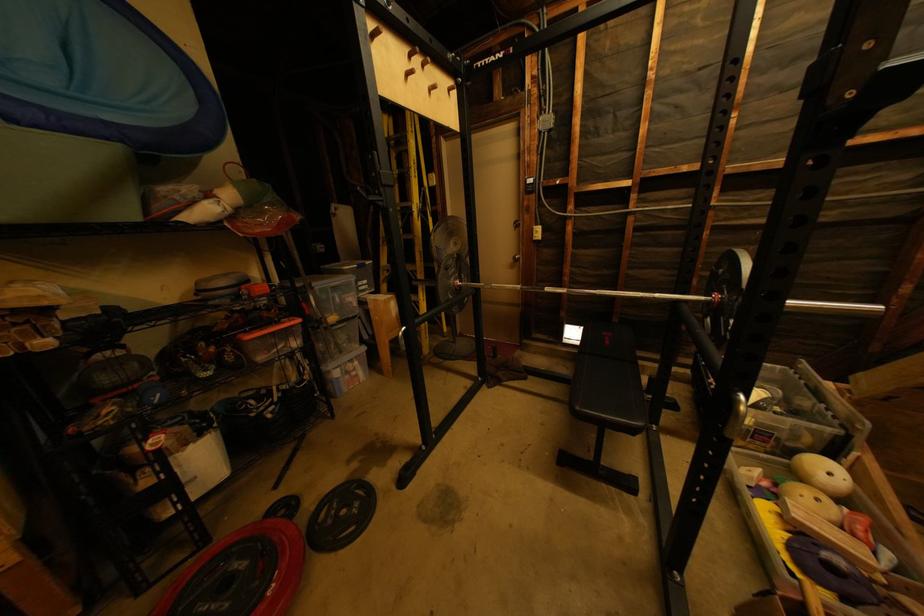
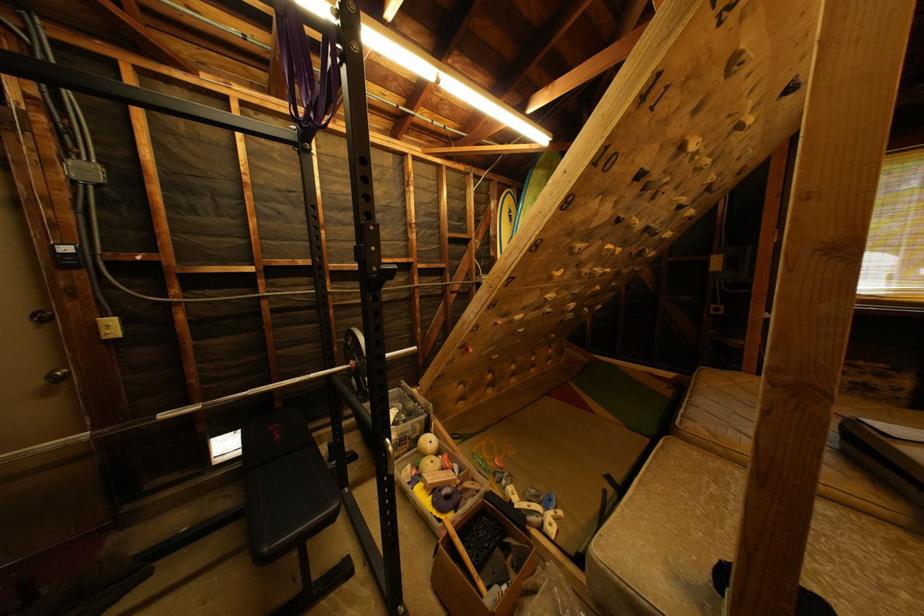
Question: How did the camera likely rotate?

Choices:
 (A) Left
 (B) Right
 (C) Up
 (D) Down

Answer: (B)